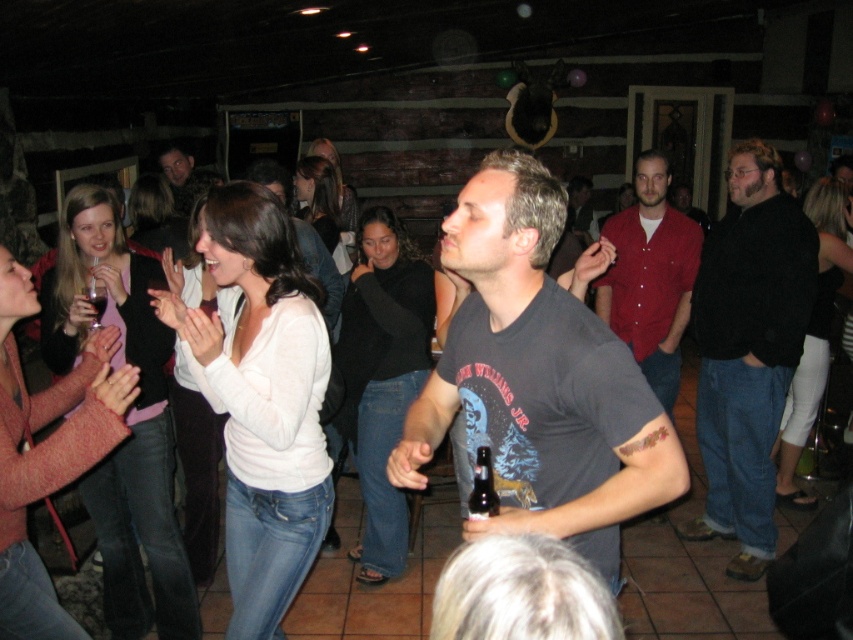
You are a photographer at the event and need to decide which clothing item to focus on for a closeup shot. Since the matte white sweater at left is larger than the matte black shirt at center, which one would you choose to ensure the subject fills the frame better?

The matte white sweater at left is bigger than the matte black shirt at center, so choosing the matte white sweater at left would ensure the subject fills the frame better.

You are a photographer at this gathering and want to capture a photo that includes both the matte white sweater at left and the matte black shirt at center. Your camera has a maximum focus range of 2 meters. Will you be able to fit both subjects into the frame without moving closer or farther away?

The distance between the matte white sweater at left and the matte black shirt at center is 1.94 meters, which is within the camera maximum focus range of 2 meters. Therefore, you can fit both subjects into the frame without adjusting your position.